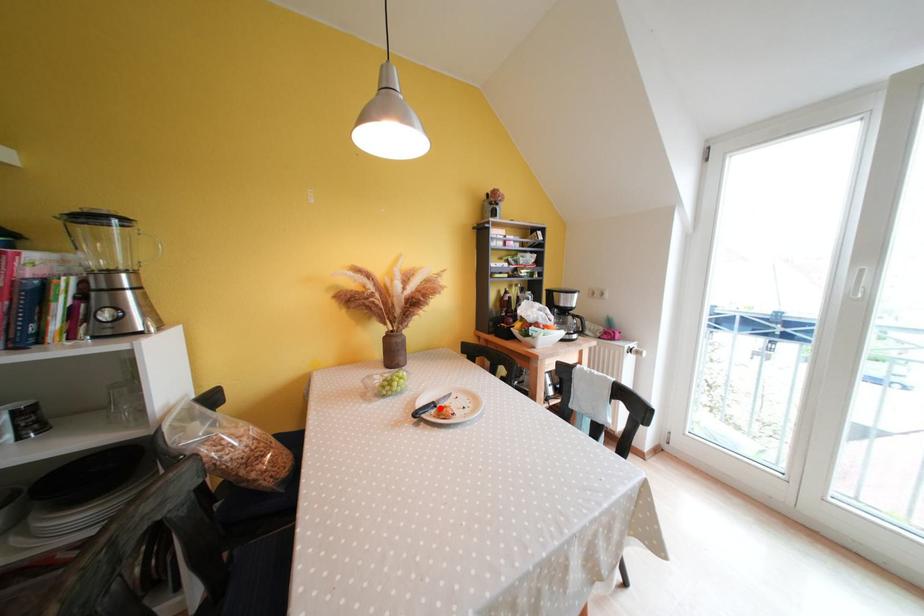
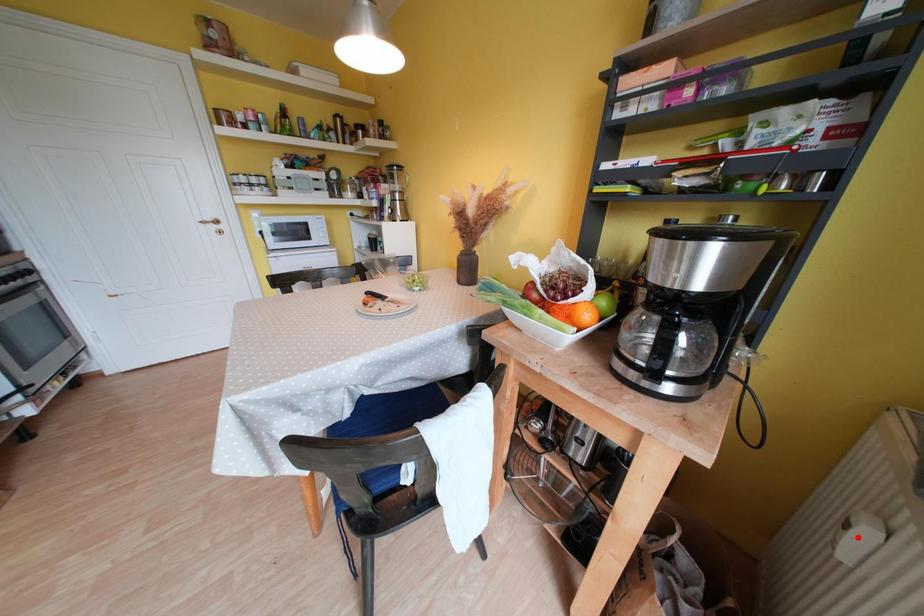
I am providing you with two images of the same scene from different viewpoints. A red point is marked on the first image and another point is marked on the second image. Are the points marked in image1 and image2 representing the same 3D position?

No